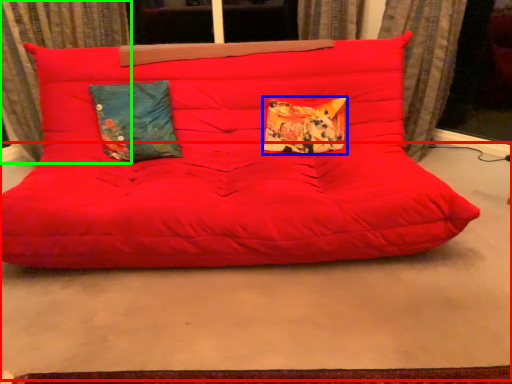
Question: Which is farther away from concrete (highlighted by a red box)? pillow (highlighted by a blue box) or curtain (highlighted by a green box)?

Choices:
 (A) pillow
 (B) curtain

Answer: (B)